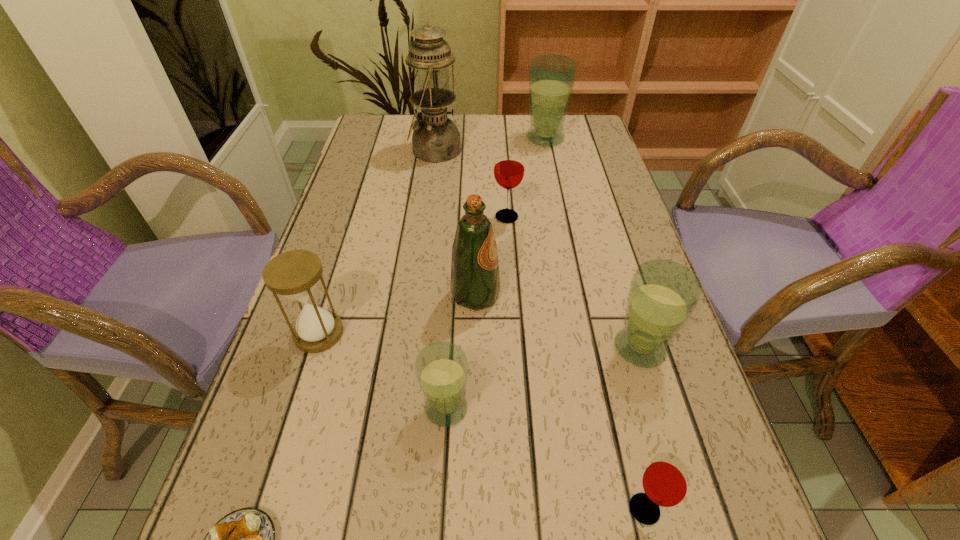
The height and width of the screenshot is (540, 960). What are the coordinates of `the fourth farthest glass` in the screenshot? It's located at (441, 368).

You are a GUI agent. You are given a task and a screenshot of the screen. Output one action in this format:
    pyautogui.click(x=<x>, y=<y>)
    Task: Click on the leftmost blue glass
    The width and height of the screenshot is (960, 540).
    Given the screenshot: What is the action you would take?
    pyautogui.click(x=441, y=368)

The height and width of the screenshot is (540, 960). I want to click on the nearest glass, so click(x=666, y=481).

Locate an element on the screen. The width and height of the screenshot is (960, 540). the nearer red glass is located at coordinates (666, 481).

Identify the location of blank area located on the front of the oil lamp. This screenshot has width=960, height=540. (420, 260).

Find the location of a particular element. Image resolution: width=960 pixels, height=540 pixels. free region located on the front-facing side of the olive oil is located at coordinates (607, 295).

The width and height of the screenshot is (960, 540). I want to click on free point located 0.340m on the front of the farthest blue glass, so click(x=562, y=222).

You are a GUI agent. You are given a task and a screenshot of the screen. Output one action in this format:
    pyautogui.click(x=<x>, y=<y>)
    Task: Click on the vacant space situated 0.210m on the front of the left red glass
    
    Given the screenshot: What is the action you would take?
    pyautogui.click(x=512, y=291)

The width and height of the screenshot is (960, 540). In order to click on vacant space situated on the front of the third farthest glass in this screenshot , I will do `click(661, 421)`.

This screenshot has height=540, width=960. What are the coordinates of `vacant space located on the right of the hourglass` in the screenshot? It's located at (537, 333).